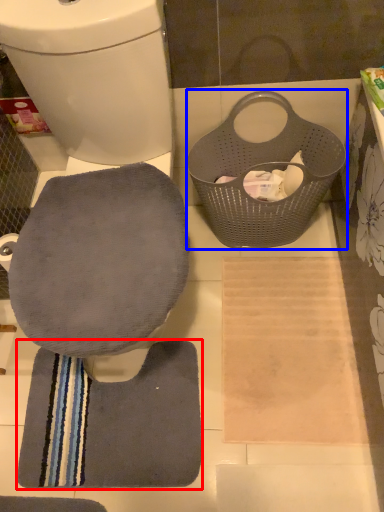
Question: Among these objects, which one is farthest to the camera, bath towel (highlighted by a red box) or laundry basket (highlighted by a blue box)?

Choices:
 (A) bath towel
 (B) laundry basket

Answer: (A)